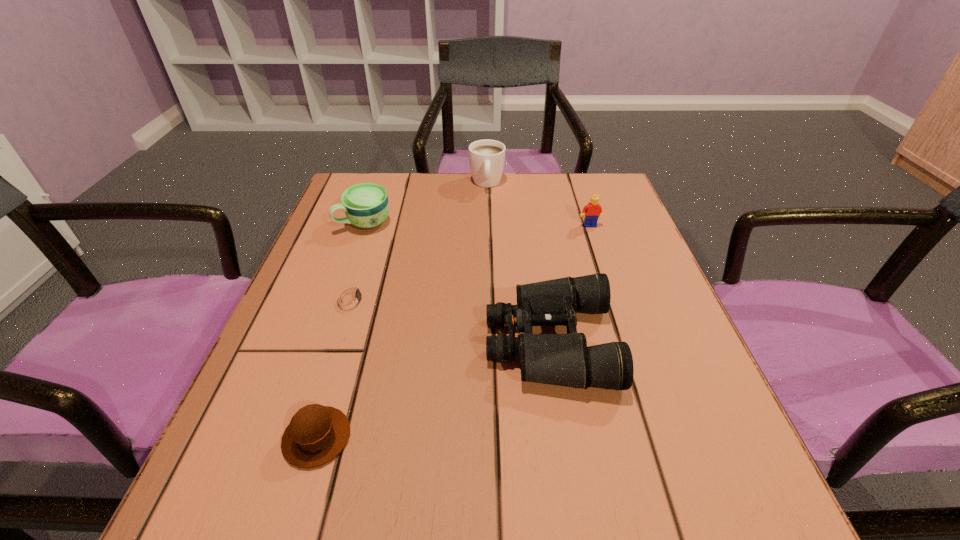
The height and width of the screenshot is (540, 960). I want to click on free space that satisfies the following two spatial constraints: 1. on the face of the shortest object; 2. on the right side of the second shortest object, so point(307,437).

Image resolution: width=960 pixels, height=540 pixels. Identify the location of vacant area that satisfies the following two spatial constraints: 1. on the face of the fifth tallest object; 2. on the right side of the watch. (307, 437).